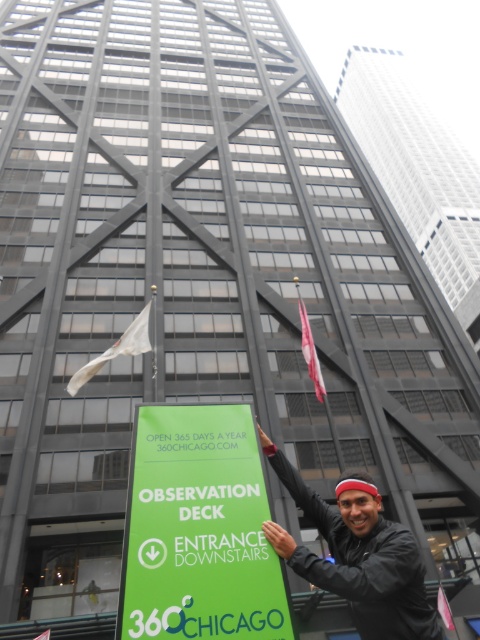
Who is more forward, (244, 452) or (376, 525)?

Point (376, 525) is in front.

Is green matte sign at center taller than black leather jacket at lower right?

Correct, green matte sign at center is much taller as black leather jacket at lower right.

Identify the location of green matte sign at center. (199, 529).

Identify the location of green matte sign at center. Image resolution: width=480 pixels, height=640 pixels. (199, 529).

Does green matte sign at center have a greater width compared to red fabric flag at center?

No, green matte sign at center is not wider than red fabric flag at center.

Which is behind, point (230, 422) or point (308, 323)?

Point (308, 323)

Find the location of a particular element. This screenshot has width=480, height=640. green matte sign at center is located at coordinates (199, 529).

Is green matte sign at center smaller than white fabric flag at center?

Correct, green matte sign at center occupies less space than white fabric flag at center.

Is point (241, 588) positioned behind point (90, 360)?

No, (241, 588) is in front of (90, 360).

Image resolution: width=480 pixels, height=640 pixels. I want to click on green matte sign at center, so click(199, 529).